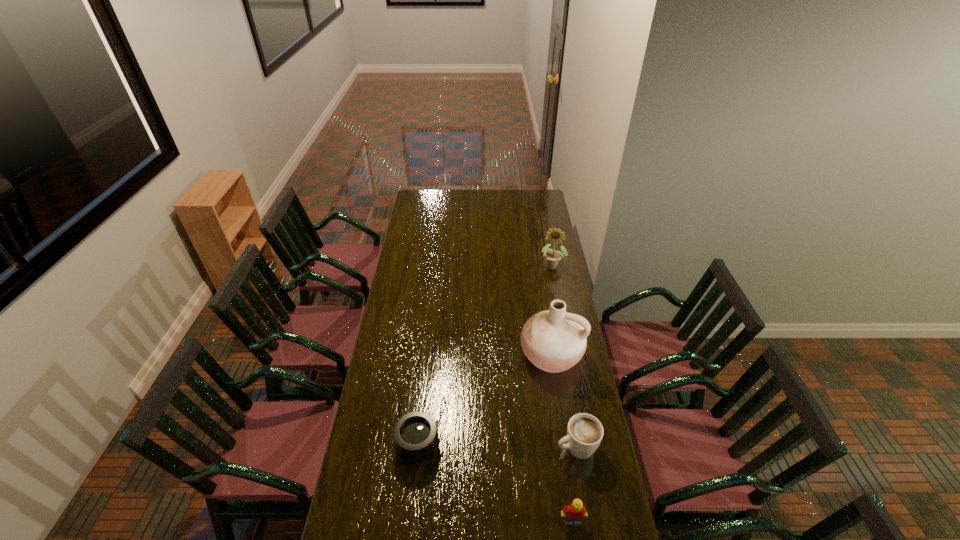
At what (x,y) coordinates should I click in order to perform the action: click on vacant spot on the desktop that is between the telephoto lens and the Lego and is positioned with the handle on the side of the cappuccino. Please return your answer as a coordinate pair (x, y). Looking at the image, I should click on (490, 480).

Locate an element on the screen. vacant spot on the desktop that is between the shortest object and the nearest object and is positioned on the front-facing side of the sunflower is located at coordinates (478, 475).

Where is `free space on the desktop that is between the shortest object and the Lego and is positioned to pour from the handle of the pottery`? The height and width of the screenshot is (540, 960). free space on the desktop that is between the shortest object and the Lego and is positioned to pour from the handle of the pottery is located at coordinates (496, 483).